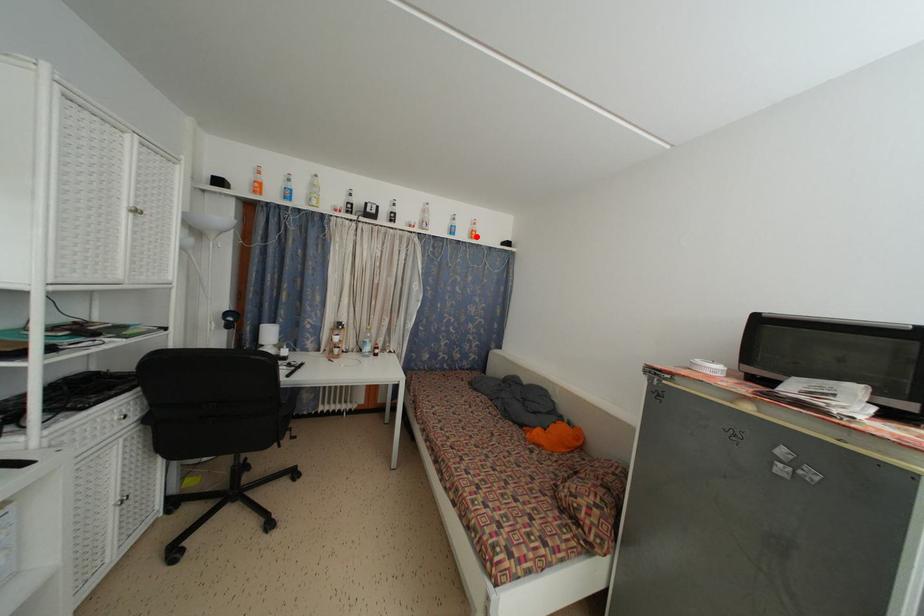
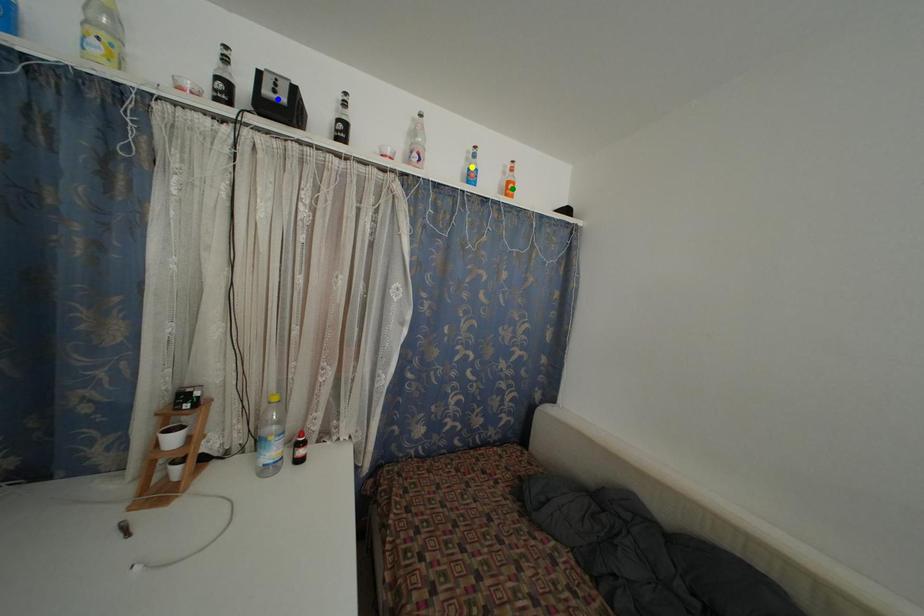
Question: I am providing you with two images of the same scene from different viewpoints. A red point is marked on the first image. You are given multiple points on the second image. Which point in image 2 represents the same 3d spot as the red point in image 1?

Choices:
 (A) yellow point
 (B) blue point
 (C) green point

Answer: (C)